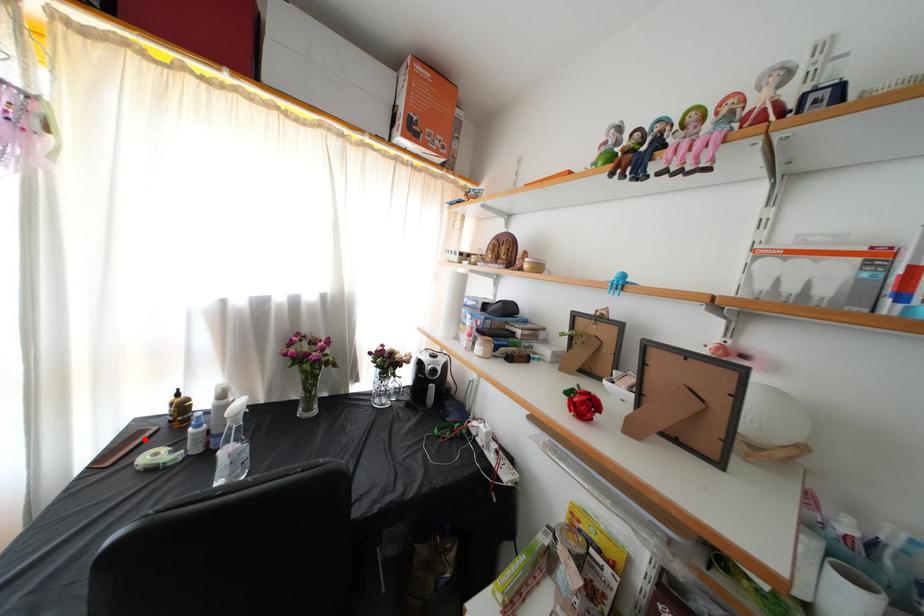
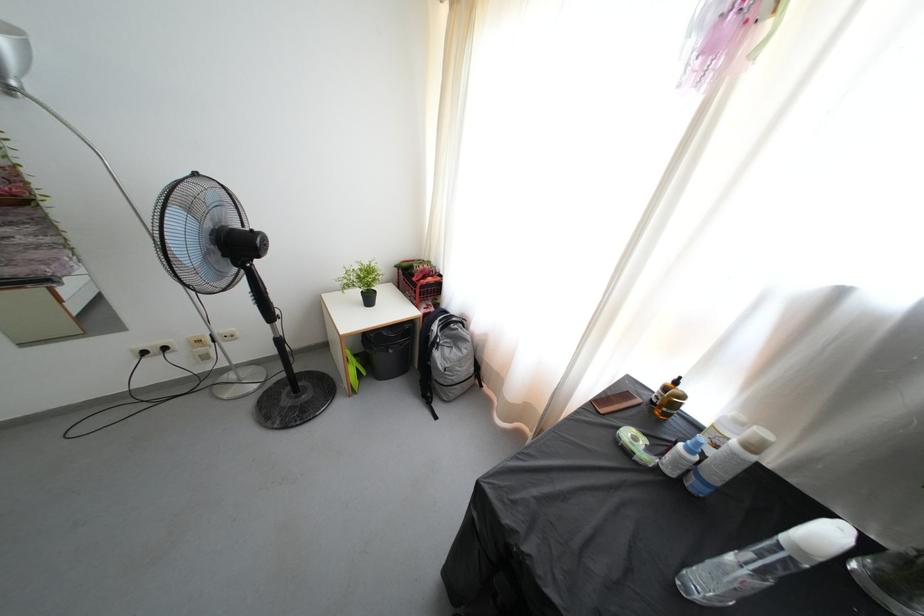
In the second image, find the point that corresponds to the highlighted location in the first image.

(633, 400)